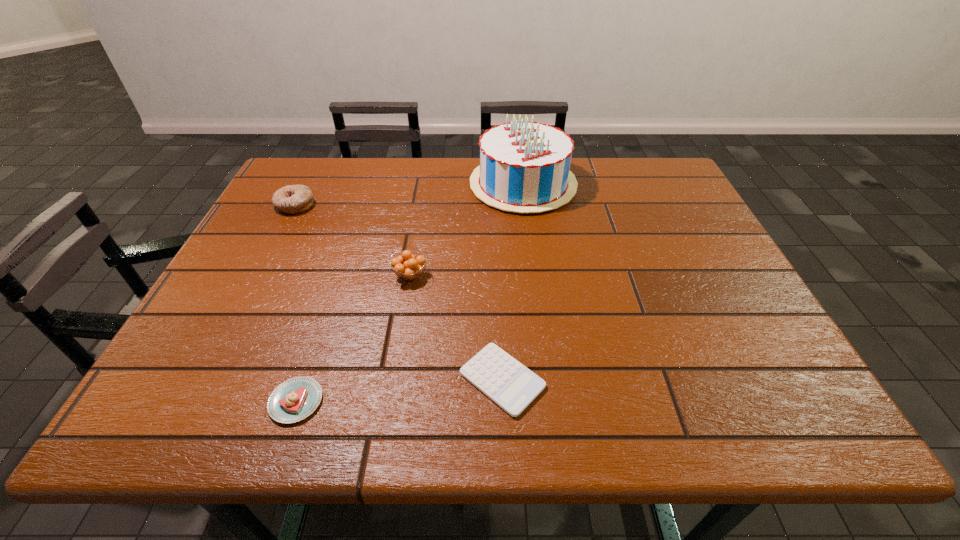
In the image, there is a desktop. Find the location of `vacant space at the left edge`. vacant space at the left edge is located at coordinates (283, 258).

This screenshot has height=540, width=960. What are the coordinates of `vacant space at the right edge` in the screenshot? It's located at (675, 228).

Identify the location of vacant area at the far left corner. (333, 179).

Find the location of a particular element. The image size is (960, 540). vacant space at the far right corner of the desktop is located at coordinates (636, 166).

Identify the location of empty space that is in between the leftmost object and the birthday cake. (409, 194).

Identify the location of vacant area that lies between the birthday cake and the shortest object. The height and width of the screenshot is (540, 960). (513, 282).

Locate an element on the screen. vacant space in between the calculator and the second shortest object is located at coordinates (399, 390).

This screenshot has height=540, width=960. In order to click on free space between the third object from right to left and the tallest object in this screenshot , I will do `click(467, 230)`.

The image size is (960, 540). I want to click on vacant area that lies between the fourth object from right to left and the leftmost object, so click(x=296, y=303).

You are a GUI agent. You are given a task and a screenshot of the screen. Output one action in this format:
    pyautogui.click(x=<x>, y=<y>)
    Task: Click on the free space between the pastry and the tallest object
    Image resolution: width=960 pixels, height=540 pixels.
    Given the screenshot: What is the action you would take?
    pyautogui.click(x=410, y=293)